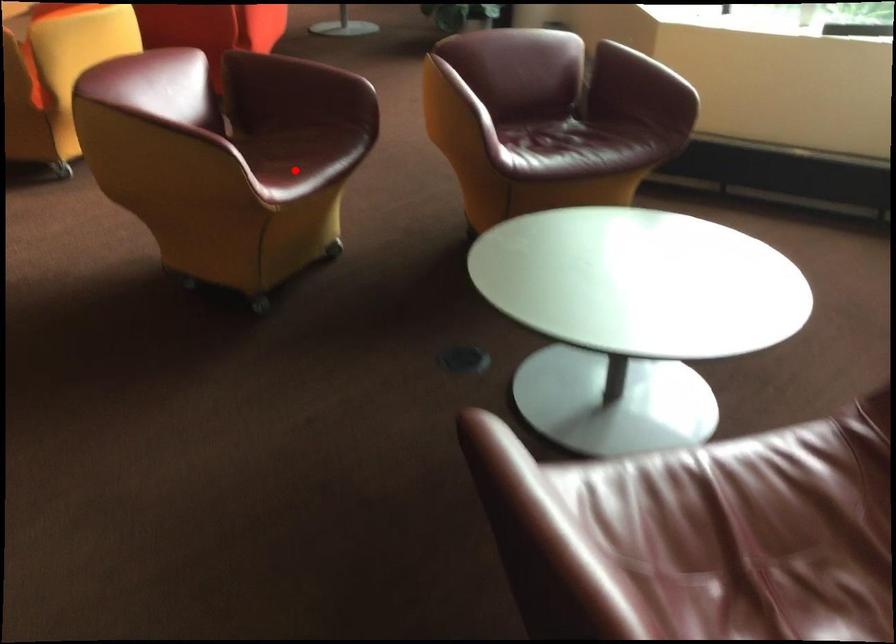
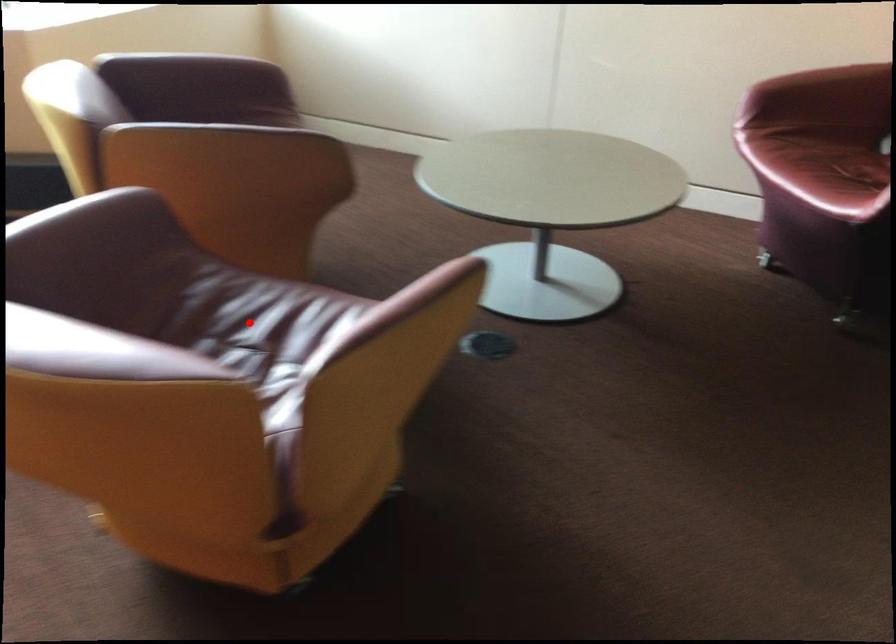
I am providing you with two images of the same scene from different viewpoints. A red point is marked on the first image and another point is marked on the second image. Are the points marked in image1 and image2 representing the same 3D position?

Yes